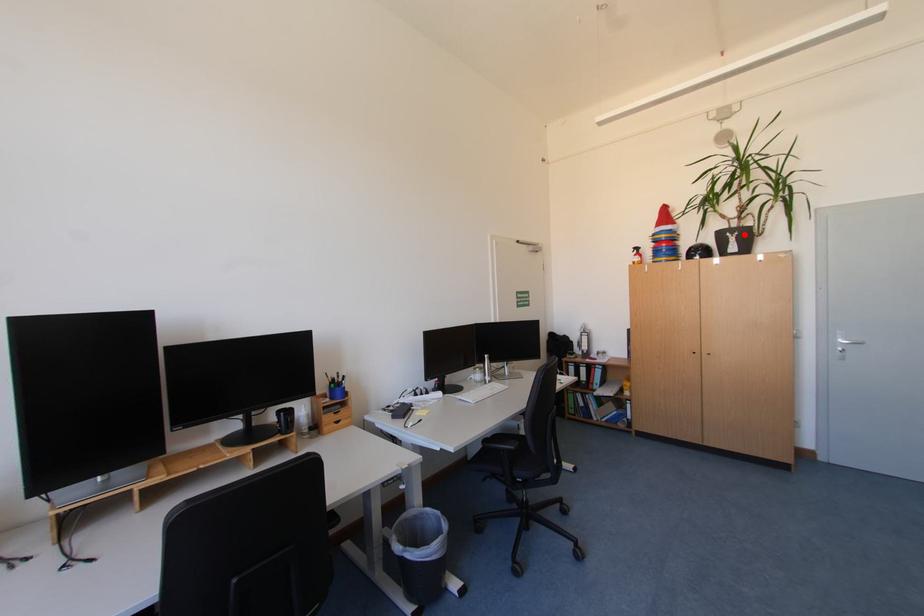
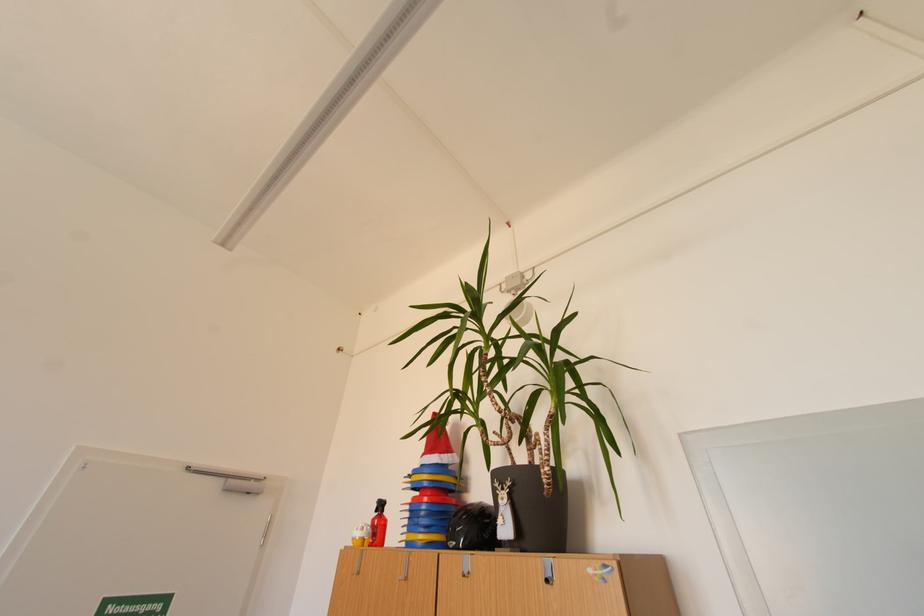
In the second image, find the point that corresponds to the highlighted location in the first image.

(517, 485)